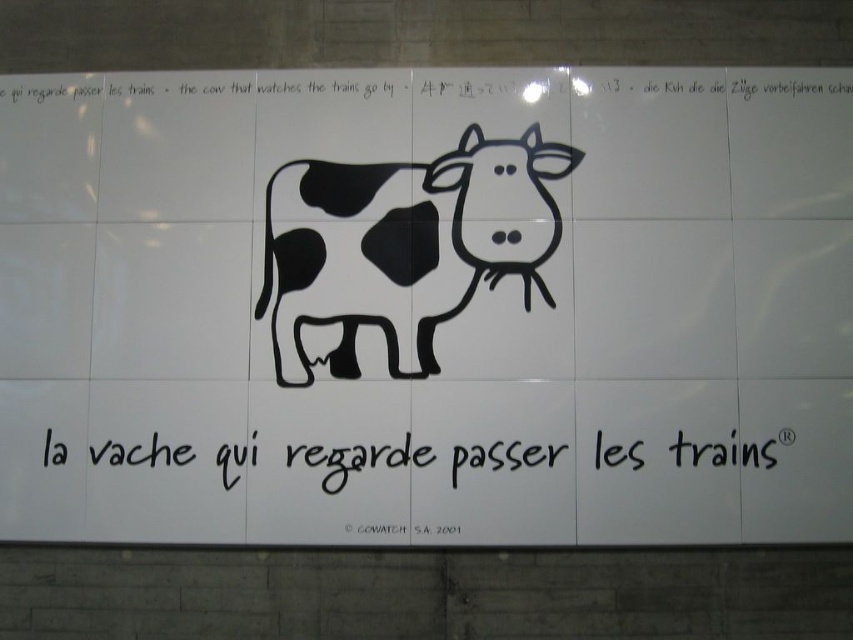
You are designing a poster and want to ensure the black matte cow at center and the black ink writing at center are proportionally balanced. Given that the cow is narrower than the text, how should you adjust their sizes to achieve balance?

Since the black matte cow at center is narrower than the black ink writing at center, to achieve proportional balance, you could either widen the cow or reduce the width of the text so that both elements have similar dimensions.

What is the spatial relationship between the black matte cow at center and the black ink writing at center in the image?

The black matte cow at center is positioned on the right side of the black ink writing at center.